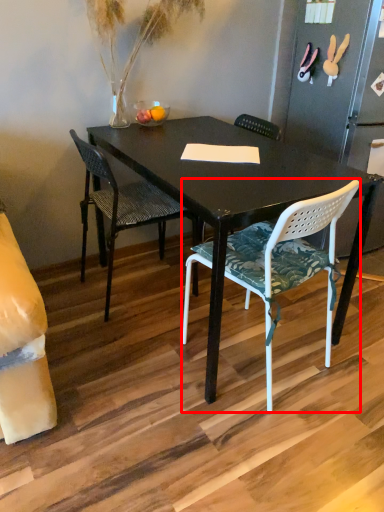
Question: Observing the image, what is the correct spatial positioning of chair (annotated by the red box) in reference to chair?

Choices:
 (A) left
 (B) right

Answer: (B)